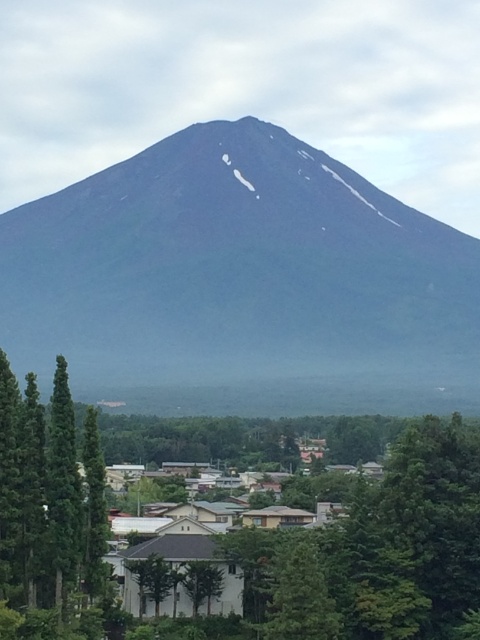
You are a hiker planning to reach the summit of the dark gray rock mountain at center. You notice a point marked at coordinates (241, 280). Based on the image, what does this point represent?

The point at coordinates (241, 280) represents the dark gray rock mountain at center, which is the mountain you want to summit.

You are planning a hiking route and need to decide whether to start from the green matte tree at lower left or the dark gray rock mountain at center. Based on their positions, which starting point would allow you to reach higher elevation faster?

The dark gray rock mountain at center is above the green matte tree at lower left, so starting from the green matte tree at lower left would provide a shorter path to reach higher elevation faster since it is already at a lower position compared to the mountain.